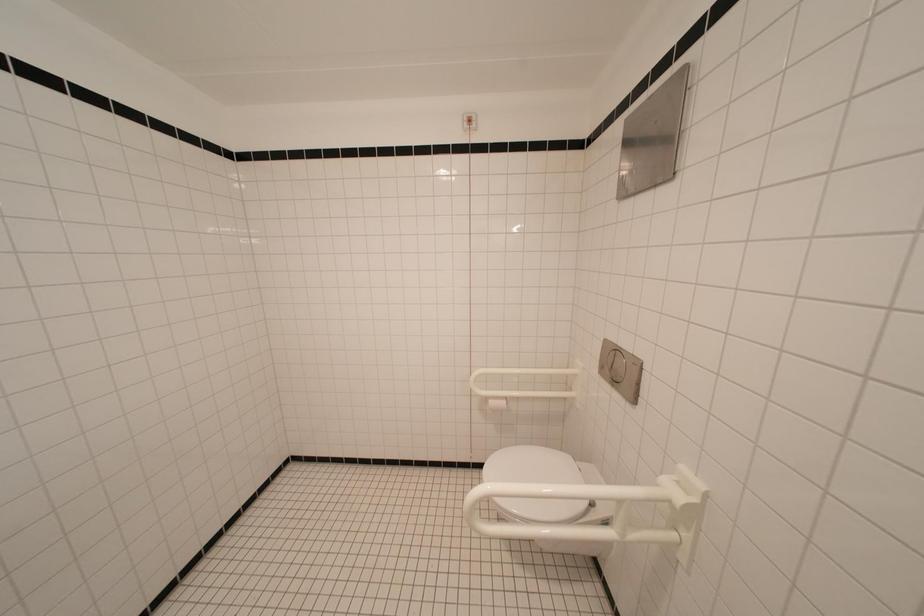
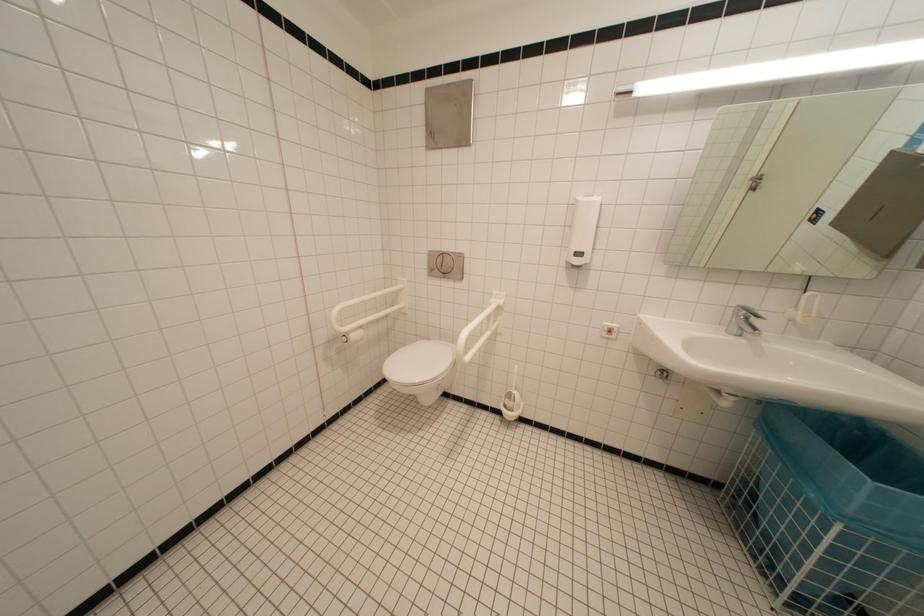
Question: The images are taken continuously from a first-person perspective. In which direction is your viewpoint rotating?

Choices:
 (A) Left
 (B) Right
 (C) Up
 (D) Down

Answer: (B)